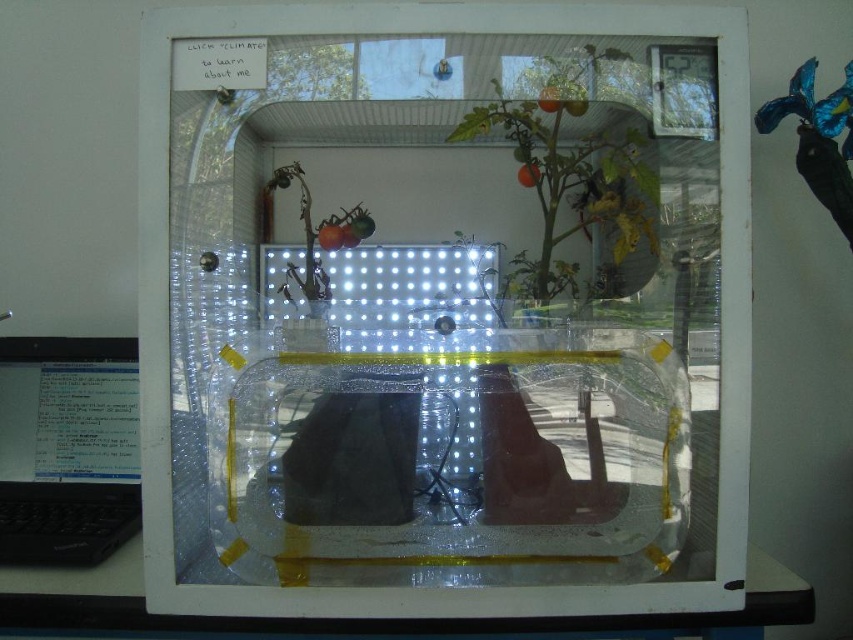
Question: Considering the real-world distances, which object is farthest from the green matte plant at center?

Choices:
 (A) black plastic laptop at lower left
 (B) transparent plastic window at center

Answer: (A)

Question: Does transparent plastic window at center appear on the right side of black plastic laptop at lower left?

Choices:
 (A) yes
 (B) no

Answer: (A)

Question: Among these objects, which one is nearest to the camera?

Choices:
 (A) black plastic laptop at lower left
 (B) green matte plant at center
 (C) transparent plastic window at center

Answer: (C)

Question: Which object is the closest to the black plastic laptop at lower left?

Choices:
 (A) transparent plastic window at center
 (B) green matte plant at center

Answer: (A)

Question: Does black plastic laptop at lower left have a lesser width compared to green matte plant at center?

Choices:
 (A) yes
 (B) no

Answer: (B)

Question: Is transparent plastic window at center positioned at the back of black plastic laptop at lower left?

Choices:
 (A) no
 (B) yes

Answer: (A)